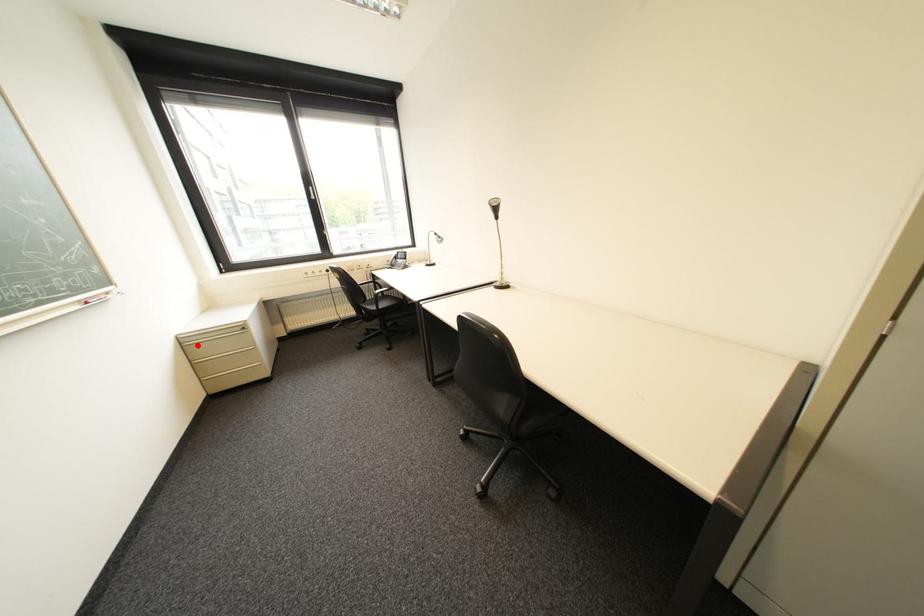
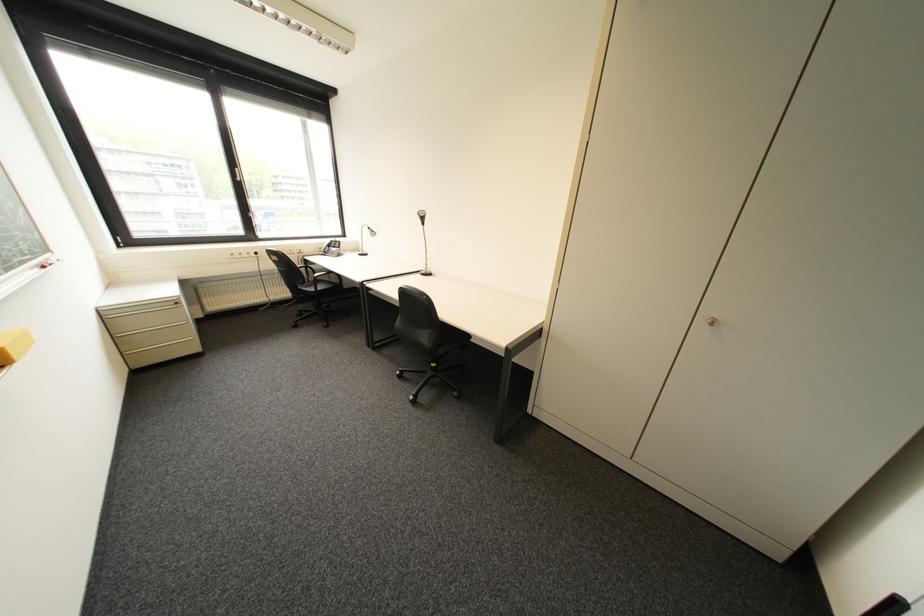
Locate, in the second image, the point that corresponds to the highlighted location in the first image.

(119, 318)